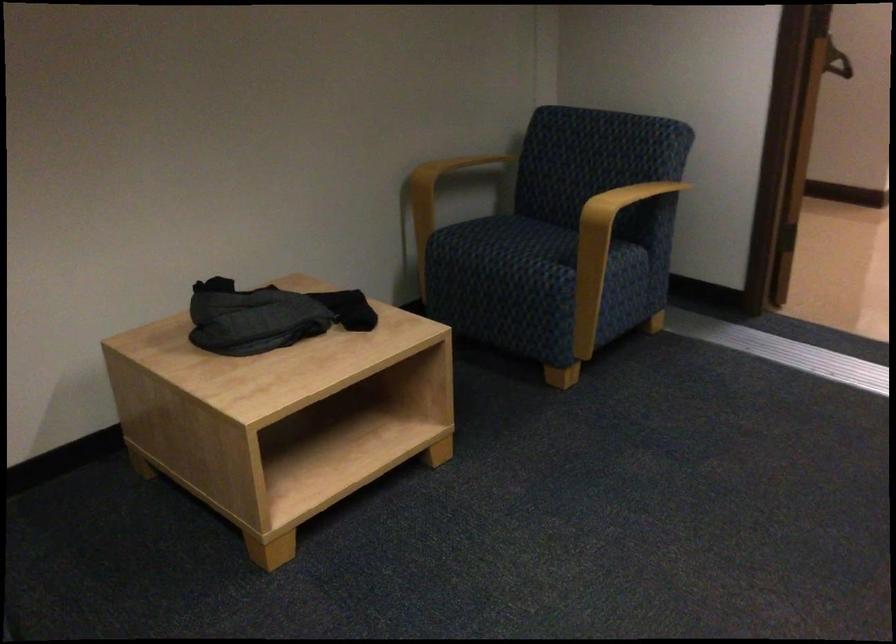
The width and height of the screenshot is (896, 644). What are the coordinates of `chair sitting surface` in the screenshot? It's located at (523, 242).